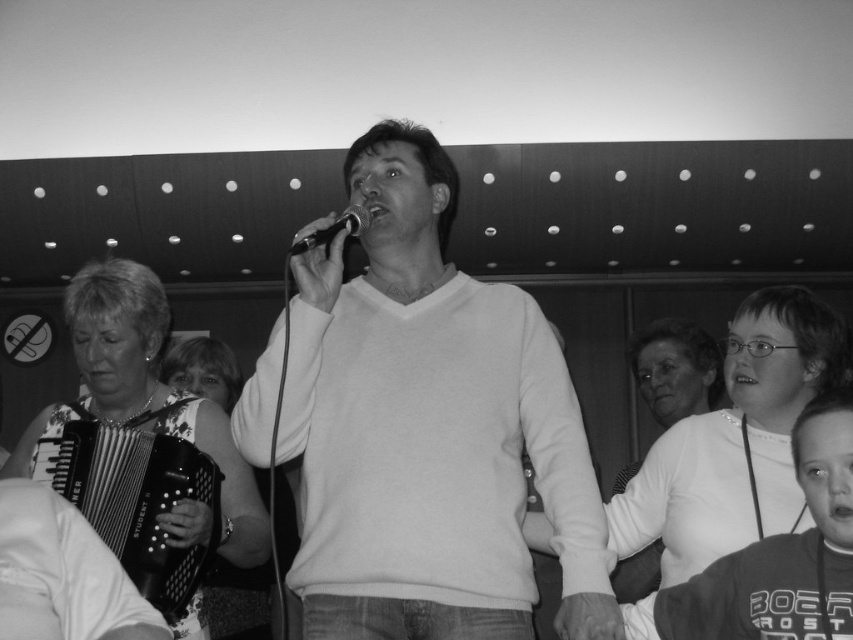
Between smooth white sweater at center and metallic black accordion at lower left, which one appears on the left side from the viewer's perspective?

metallic black accordion at lower left

Does smooth white sweater at center appear on the left side of metallic black accordion at lower left?

In fact, smooth white sweater at center is to the right of metallic black accordion at lower left.

Between point (607, 618) and point (79, 502), which one is positioned in front?

Positioned in front is point (607, 618).

Find the location of `smooth white sweater at center`. smooth white sweater at center is located at coordinates (428, 428).

Does smooth white sweater at center lie in front of black metallic microphone at center?

No, it is not.

Does smooth white sweater at center have a lesser height compared to black metallic microphone at center?

In fact, smooth white sweater at center may be taller than black metallic microphone at center.

Identify the location of smooth white sweater at center. The width and height of the screenshot is (853, 640). (428, 428).

Can you confirm if metallic black accordion at lower left is positioned to the right of black metallic microphone at center?

No, metallic black accordion at lower left is not to the right of black metallic microphone at center.

From the picture: Is metallic black accordion at lower left below black metallic microphone at center?

Correct, metallic black accordion at lower left is located below black metallic microphone at center.

Which is in front, point (186, 461) or point (361, 209)?

Point (361, 209) is in front.

Image resolution: width=853 pixels, height=640 pixels. Find the location of `metallic black accordion at lower left`. metallic black accordion at lower left is located at coordinates (136, 496).